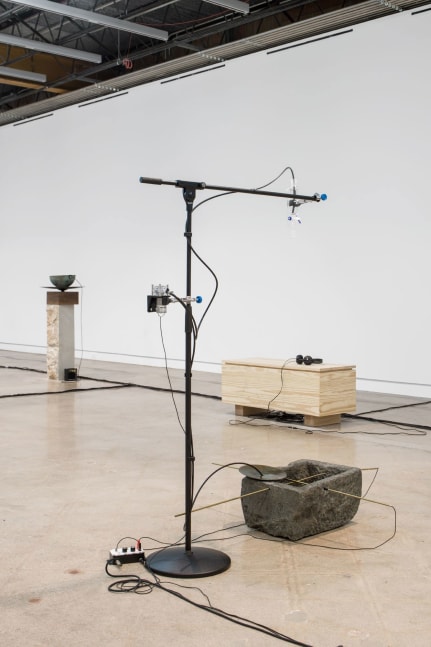
In order to click on lights in this screenshot , I will do `click(25, 74)`, `click(55, 47)`, `click(109, 19)`, `click(234, 5)`.